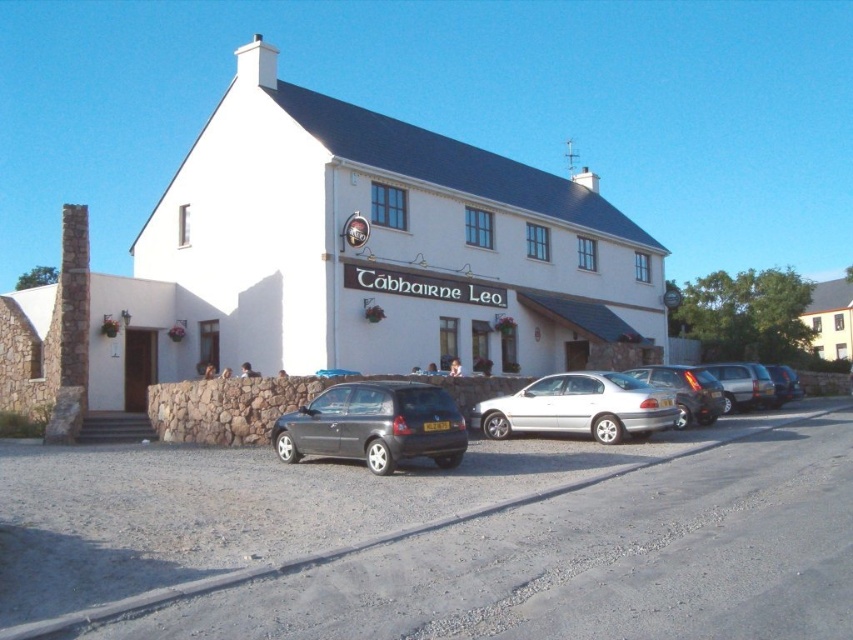
Does matte gray hatchback at center have a greater height compared to silver metallic hatchback at right?

Correct, matte gray hatchback at center is much taller as silver metallic hatchback at right.

Consider the image. Is matte gray hatchback at center to the left of silver metallic hatchback at right from the viewer's perspective?

Correct, you'll find matte gray hatchback at center to the left of silver metallic hatchback at right.

What do you see at coordinates (374, 426) in the screenshot? The image size is (853, 640). I see `matte gray hatchback at center` at bounding box center [374, 426].

The width and height of the screenshot is (853, 640). Find the location of `matte gray hatchback at center`. matte gray hatchback at center is located at coordinates (374, 426).

Locate an element on the screen. smooth asphalt parking lot at center is located at coordinates (440, 540).

Between point (57, 580) and point (749, 371), which one is positioned behind?

Positioned behind is point (749, 371).

Based on the photo, who is more forward, (381, 524) or (746, 392)?

Point (381, 524) is more forward.

The height and width of the screenshot is (640, 853). In order to click on smooth asphalt parking lot at center in this screenshot , I will do `click(440, 540)`.

Which is behind, point (352, 477) or point (704, 397)?

Point (704, 397)

Is smooth asphalt parking lot at center taller than metallic silver sedan at center?

Incorrect, smooth asphalt parking lot at center's height is not larger of metallic silver sedan at center's.

Image resolution: width=853 pixels, height=640 pixels. What are the coordinates of `smooth asphalt parking lot at center` in the screenshot? It's located at pos(440,540).